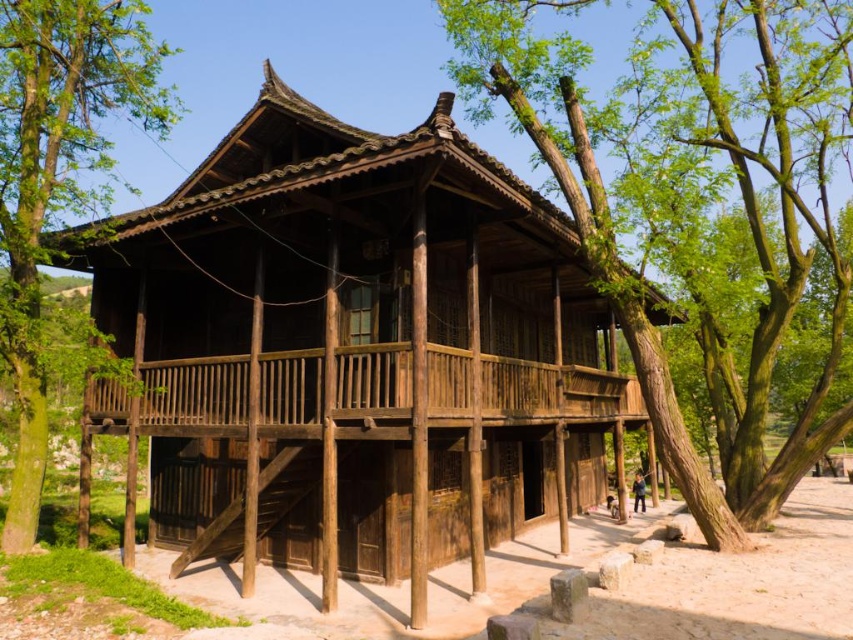
Question: Based on their relative distances, which object is farther from the green wood tree at left?

Choices:
 (A) wooden house at center
 (B) green wood tree at center

Answer: (B)

Question: Does wooden house at center have a lesser width compared to green wood tree at center?

Choices:
 (A) no
 (B) yes

Answer: (A)

Question: Which point appears closest to the camera in this image?

Choices:
 (A) (477, 394)
 (B) (62, 163)

Answer: (A)

Question: Which is nearer to the wooden house at center?

Choices:
 (A) green wood tree at center
 (B) green wood tree at left

Answer: (A)

Question: Can you confirm if wooden house at center is positioned to the right of green wood tree at center?

Choices:
 (A) yes
 (B) no

Answer: (B)

Question: Does wooden house at center come in front of green wood tree at center?

Choices:
 (A) no
 (B) yes

Answer: (B)